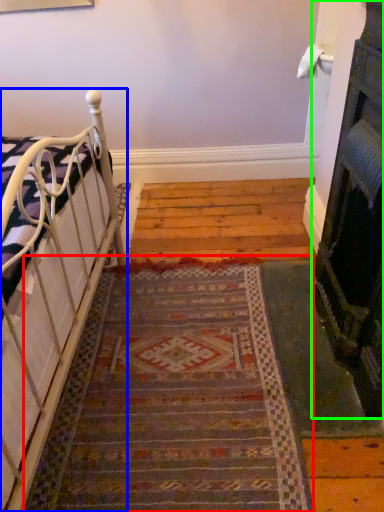
Question: Based on their relative distances, which object is nearer to doormat (highlighted by a red box)? Choose from furniture (highlighted by a blue box) and fireplace (highlighted by a green box).

Choices:
 (A) furniture
 (B) fireplace

Answer: (A)